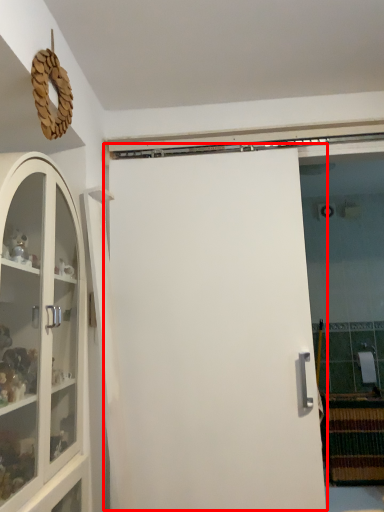
Question: From the image, what is the correct spatial relationship of door (annotated by the red box) in relation to cabinetry?

Choices:
 (A) left
 (B) right

Answer: (B)